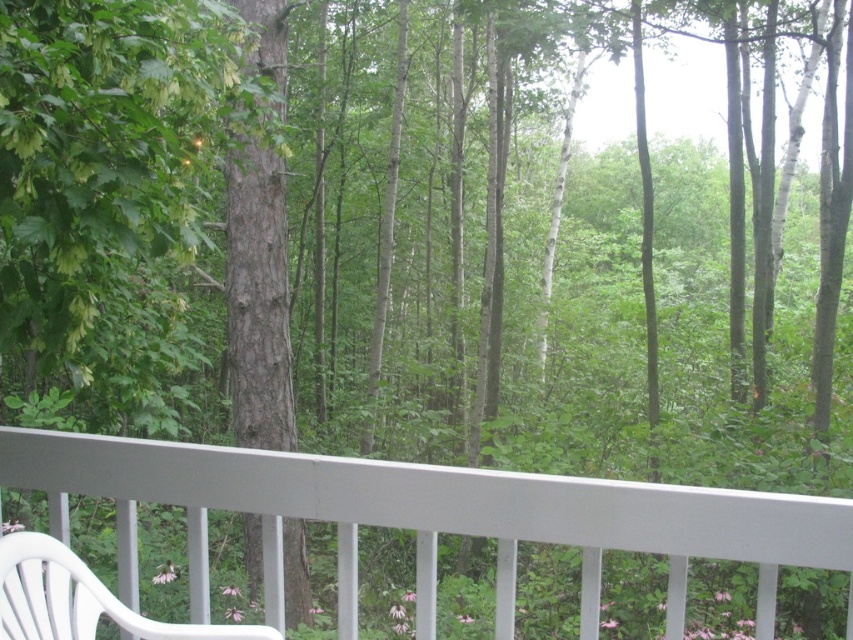
You are standing on the balcony and want to compare the sizes of the brown rough bark tree at center and the white plastic rocking chair at lower left. Based on the scene, which object is bigger?

The brown rough bark tree at center is larger in size compared to the white plastic rocking chair at lower left.

You are standing on the balcony and want to sit down. You see the white plastic chair at lower left and the white plastic rocking chair at lower left. Which one is taller and therefore might be more comfortable for you to sit on?

The white plastic chair at lower left is taller than the white plastic rocking chair at lower left, so it might be more comfortable to sit on.